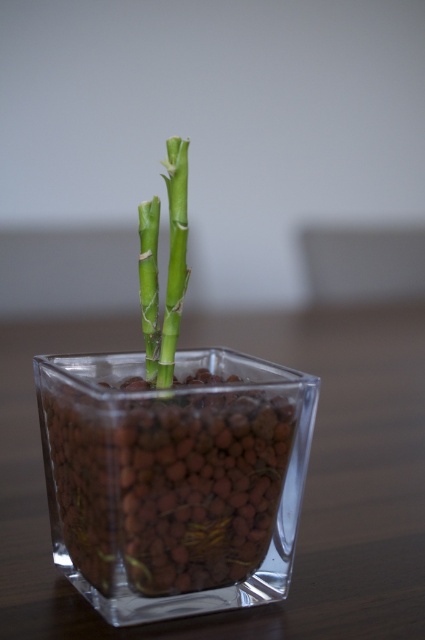
You are arranging a small indoor garden and have a transparent glass vase at center and a green matte bamboo at center. Which object is taller?

The transparent glass vase at center is taller than the green matte bamboo at center.

You are a photographer trying to capture a closeup of the transparent glass vase at center. If your camera requires the subject to be within 5 inches for optimal focus, will you need to adjust your position?

The transparent glass vase at center is 7.69 inches away from the camera, which is beyond the 5 inch requirement for optimal focus. You will need to move closer to the vase to achieve the best focus.